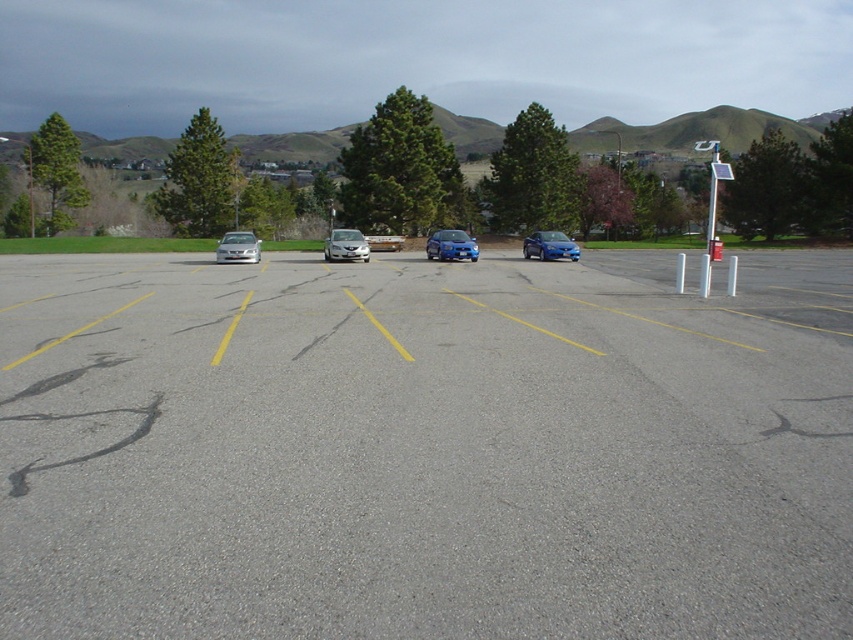
In the scene shown: You are standing at the point closest to the front of the parking lot and want to walk towards the back. Which point, point (604, 138) or point (563, 237), will you reach first?

Point (563, 237) will be reached first because it is closer to the front of the parking lot than point (604, 138), which is further back.

You are a parking attendant and need to direct a driver to park their car. The driver wants to park their new metallic silver car at center without blocking the satin blue sedan at center. Is this possible given their current positions?

The metallic silver car at center is positioned over the satin blue sedan at center, meaning they are already occupying the same space. Therefore, it is not possible to park the metallic silver car there without blocking the satin blue sedan at center.